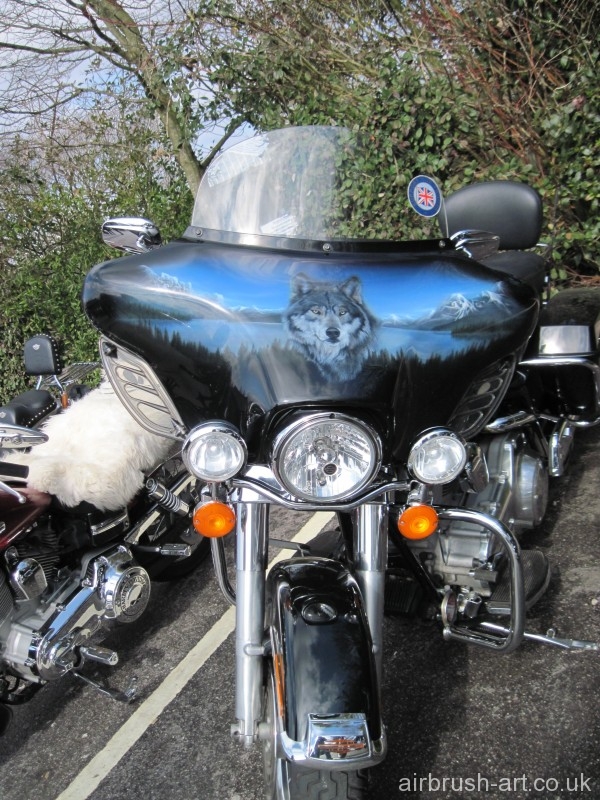
Identify the location of white furry seat cover. (107, 437).